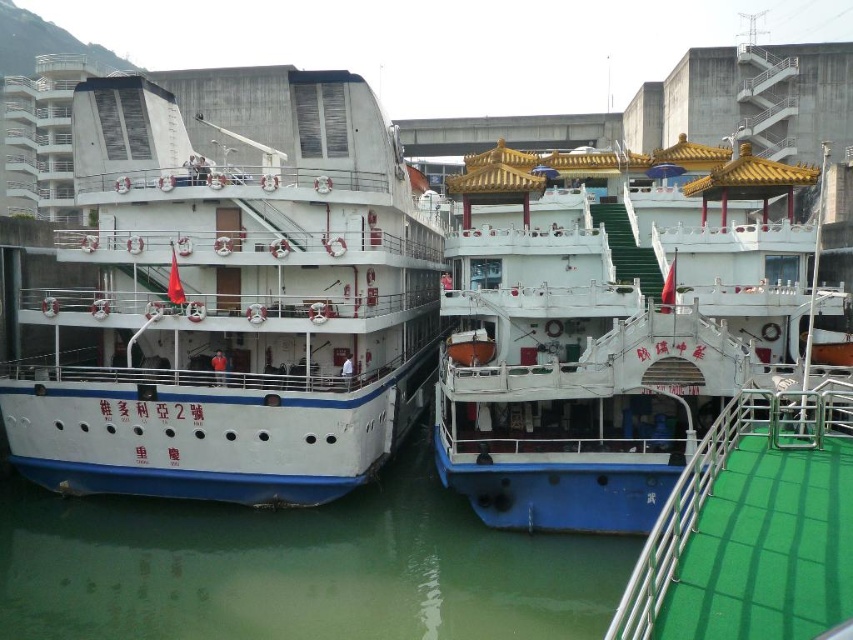
You are a crane operator tasked with moving a container that is 15 meters long from the white matte cruise ship at left to the white glossy boat at center. Based on the distance between them, can the container be safely transported without any part of it extending beyond the space between the two vessels?

The distance between the white matte cruise ship at left and the white glossy boat at center is 17.28 meters. Since the container is 15 meters long, there is sufficient space to transport it safely without overhang.

You are a dock worker who needs to secure both ships to the pier. The white glossy boat at center has a height restriction of 10 meters. Can you safely secure the white matte cruise ship at left to the same pier without exceeding the height limit?

The white matte cruise ship at left has a greater height compared to the white glossy boat at center. Since the white glossy boat at center is under the 10 meters height restriction, the white matte cruise ship at left would exceed the 10 meters limit and cannot be secured safely.